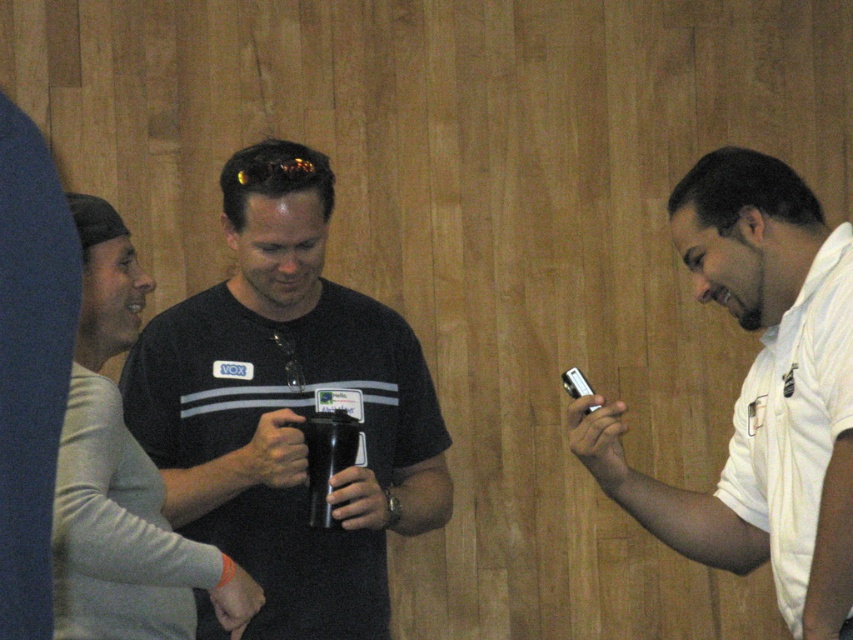
Question: Which object appears closest to the camera in this image?

Choices:
 (A) black matte t-shirt at center
 (B) white cotton polo shirt at right
 (C) white matte shirt at right

Answer: (C)

Question: Which object appears closest to the camera in this image?

Choices:
 (A) black matte t-shirt at center
 (B) white cotton polo shirt at right
 (C) white matte shirt at right

Answer: (C)

Question: Can you confirm if black matte t-shirt at center is smaller than white matte shirt at right?

Choices:
 (A) no
 (B) yes

Answer: (B)

Question: Which is farther from the white cotton polo shirt at right?

Choices:
 (A) white matte shirt at right
 (B) black matte t-shirt at center

Answer: (B)

Question: Observing the image, what is the correct spatial positioning of black matte t-shirt at center in reference to white cotton polo shirt at right?

Choices:
 (A) above
 (B) below

Answer: (A)

Question: Does black matte t-shirt at center appear on the right side of white cotton polo shirt at right?

Choices:
 (A) no
 (B) yes

Answer: (A)